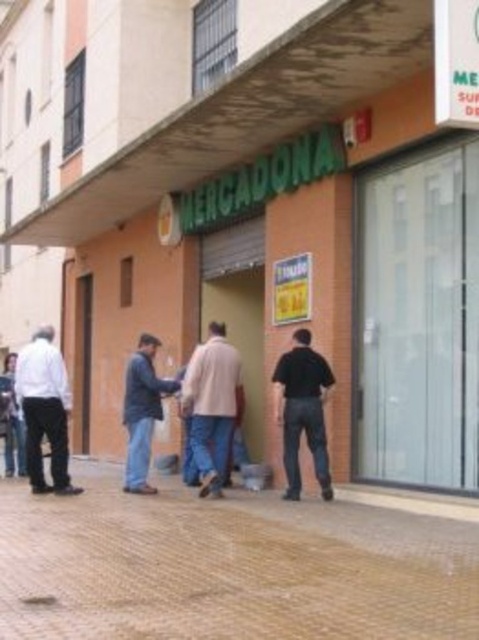
Question: Which point is closer to the camera?

Choices:
 (A) black matte shirt at center
 (B) dark blue denim jeans at center
 (C) brown brick pavement at center
 (D) white shirt at left

Answer: (C)

Question: Among these points, which one is farthest from the camera?

Choices:
 (A) (138, 435)
 (B) (57, 490)
 (C) (285, 520)

Answer: (B)

Question: Can you confirm if light beige coat at center is bigger than dark blue denim jeans at center?

Choices:
 (A) yes
 (B) no

Answer: (A)

Question: Is black matte shirt at center positioned in front of dark blue denim jeans at center?

Choices:
 (A) yes
 (B) no

Answer: (A)

Question: Which point is farther to the camera?

Choices:
 (A) black matte shirt at center
 (B) brown brick pavement at center

Answer: (A)

Question: In this image, where is brown brick pavement at center located relative to light beige coat at center?

Choices:
 (A) above
 (B) below

Answer: (B)